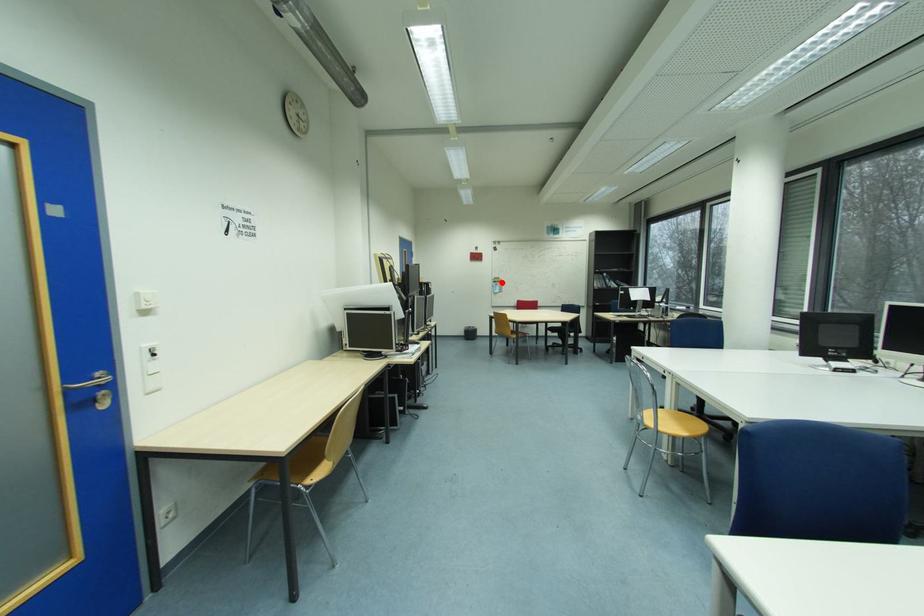
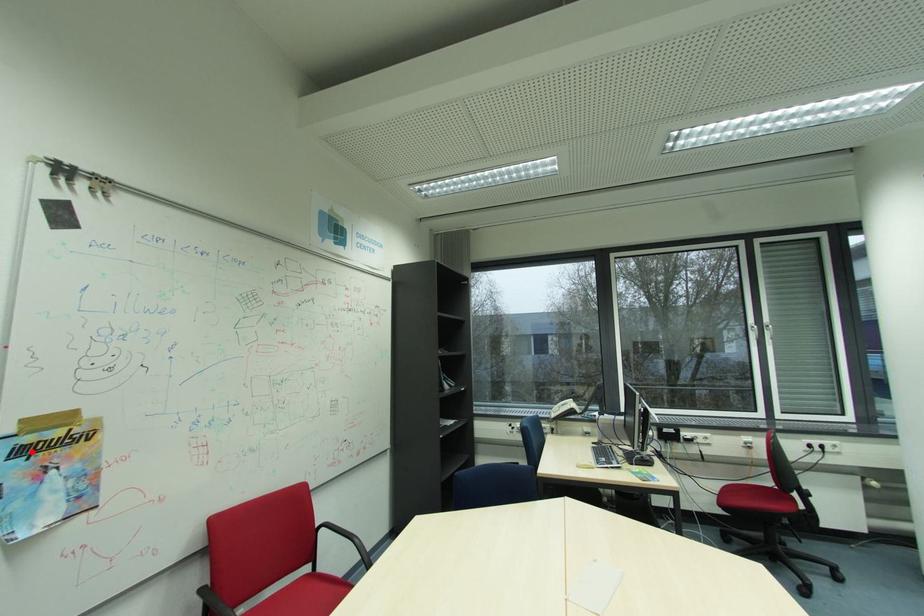
I am providing you with two images of the same scene from different viewpoints. A red point is marked on the first image and another point is marked on the second image. Is the red point in image1 aligned with the point shown in image2?

Yes